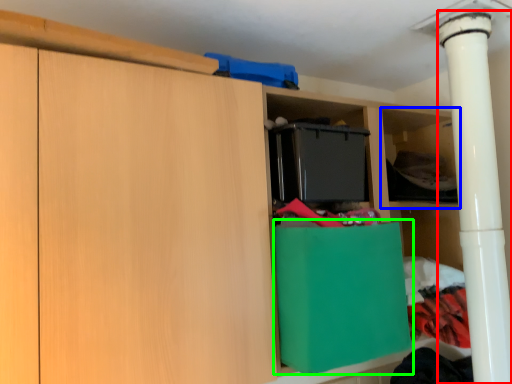
Question: Which is farther away from pillar (highlighted by a red box)? shelf (highlighted by a blue box) or cabinetry (highlighted by a green box)?

Choices:
 (A) shelf
 (B) cabinetry

Answer: (B)